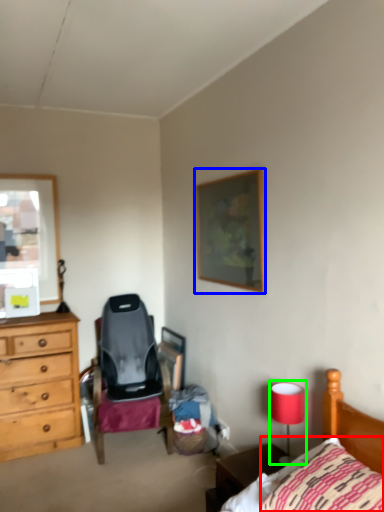
Question: Which object is positioned farthest from pillow (highlighted by a red box)? Select from picture frame (highlighted by a blue box) and table lamp (highlighted by a green box).

Choices:
 (A) picture frame
 (B) table lamp

Answer: (A)